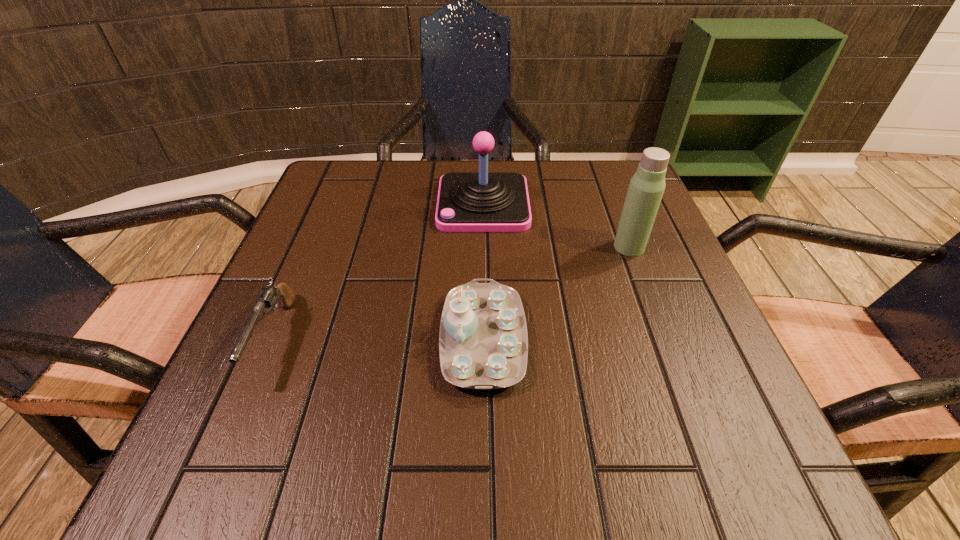
Find the location of a particular element. The image size is (960, 540). free space located 0.200m on the back of the chinaware is located at coordinates (483, 224).

Where is `free region located 0.100m aiming along the barrel of the gun`? This screenshot has height=540, width=960. free region located 0.100m aiming along the barrel of the gun is located at coordinates (223, 461).

Image resolution: width=960 pixels, height=540 pixels. Identify the location of object at the far edge. (483, 201).

I want to click on object at the left edge, so click(269, 295).

In order to click on object that is at the right edge in this screenshot , I will do `click(646, 187)`.

Image resolution: width=960 pixels, height=540 pixels. In the image, there is a desktop. What are the coordinates of `free region at the far edge` in the screenshot? It's located at (410, 193).

You are a GUI agent. You are given a task and a screenshot of the screen. Output one action in this format:
    pyautogui.click(x=<x>, y=<y>)
    Task: Click on the vacant space at the near edge
    The image size is (960, 540).
    Given the screenshot: What is the action you would take?
    pyautogui.click(x=363, y=439)

In the image, there is a desktop. Identify the location of free region at the left edge. (320, 300).

Locate an element on the screen. The image size is (960, 540). vacant region at the right edge of the desktop is located at coordinates [615, 310].

Find the location of a particular element. blank space at the far left corner is located at coordinates (306, 212).